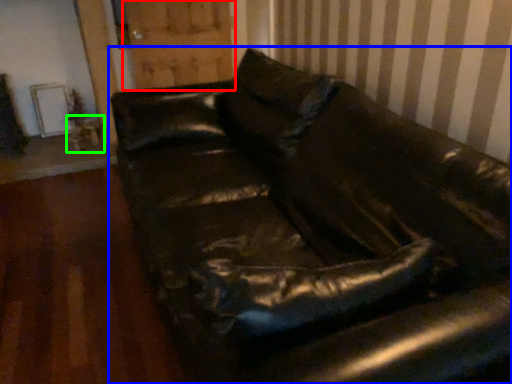
Question: Based on their relative distances, which object is farther from barn door (highlighted by a red box)? Choose from studio couch (highlighted by a blue box) and table (highlighted by a green box).

Choices:
 (A) studio couch
 (B) table

Answer: (A)